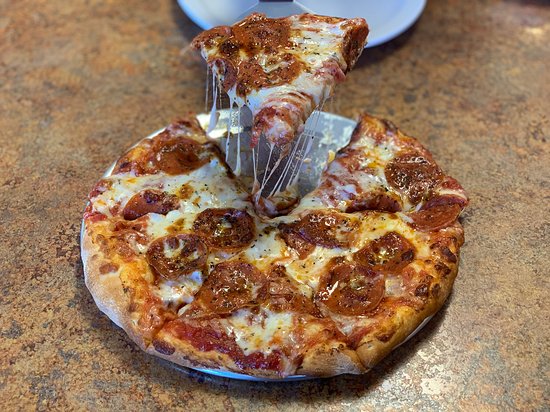
You are a GUI agent. You are given a task and a screenshot of the screen. Output one action in this format:
    pyautogui.click(x=<x>, y=<y>)
    Task: Click on the empty white plate
    The height and width of the screenshot is (412, 550).
    Given the screenshot: What is the action you would take?
    pyautogui.click(x=382, y=20)